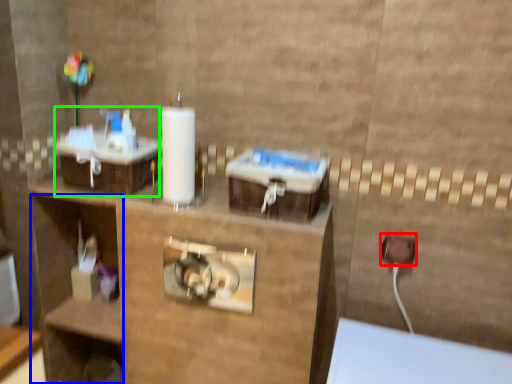
Question: Estimate the real-world distances between objects in this image. Which object is farther from electric outlet (highlighted by a red box), shelf (highlighted by a blue box) or sink (highlighted by a green box)?

Choices:
 (A) shelf
 (B) sink

Answer: (A)